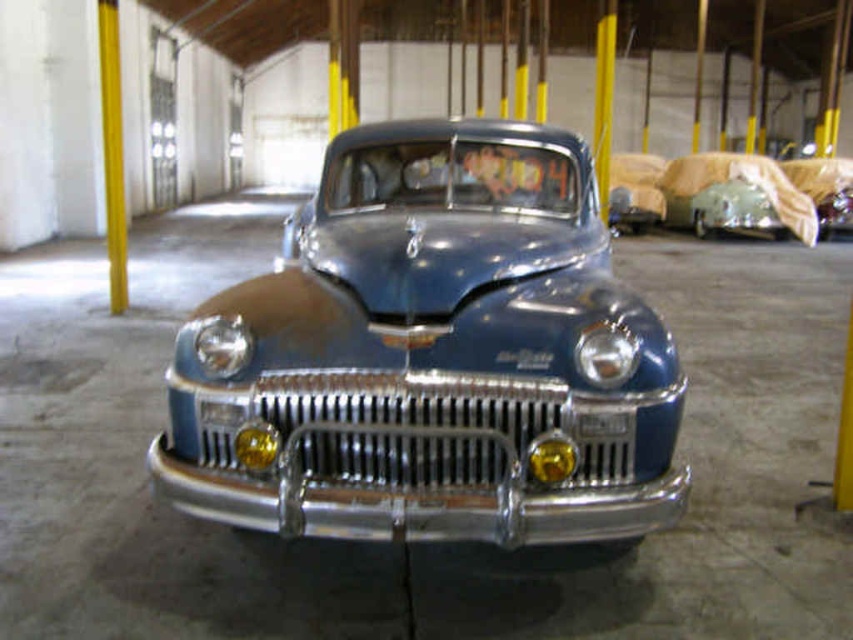
Does metallic blue car at center appear over yellow polished metal pole at left?

No, metallic blue car at center is not above yellow polished metal pole at left.

Can you confirm if metallic blue car at center is smaller than yellow polished metal pole at left?

No.

Who is more distant from viewer, [444,145] or [102,93]?

The point [102,93] is behind.

At what (x,y) coordinates should I click in order to perform the action: click on metallic blue car at center. Please return your answer as a coordinate pair (x, y). The height and width of the screenshot is (640, 853). Looking at the image, I should click on (432, 356).